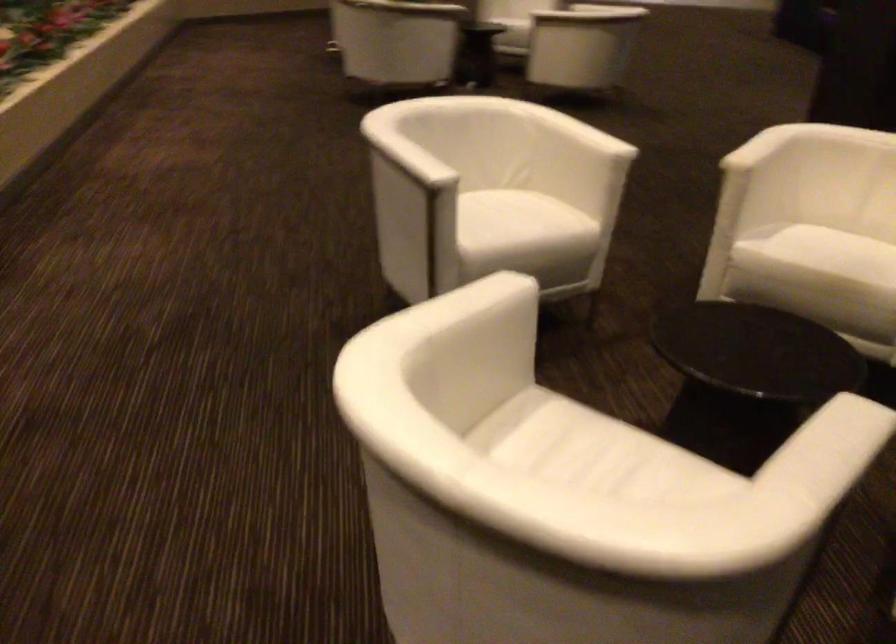
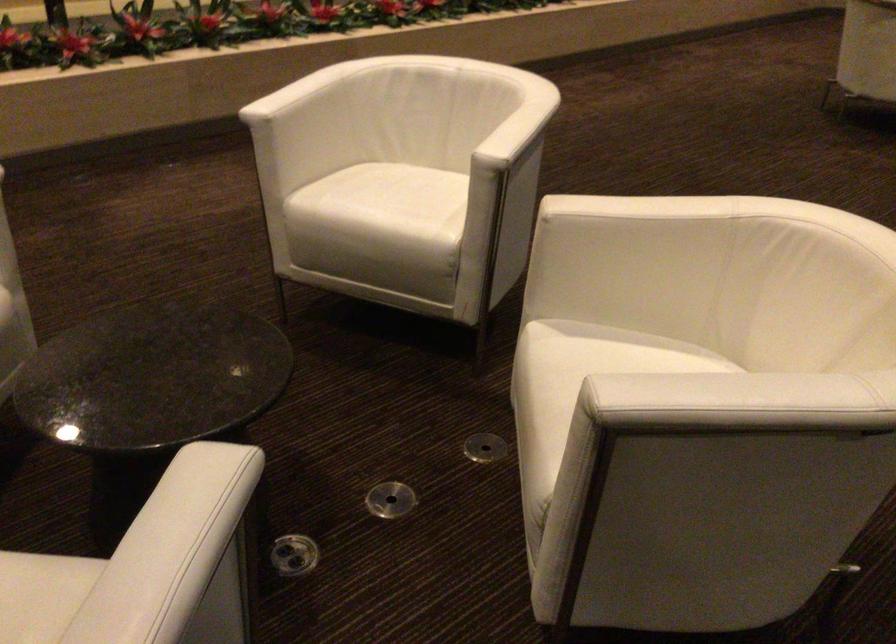
Where in the second image is the point corresponding to (x=778, y=351) from the first image?

(152, 377)